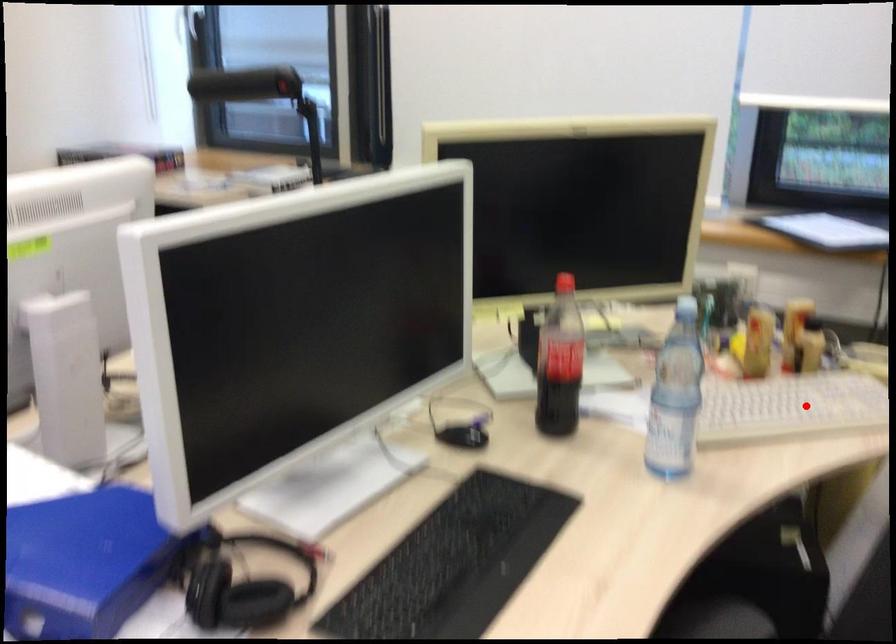
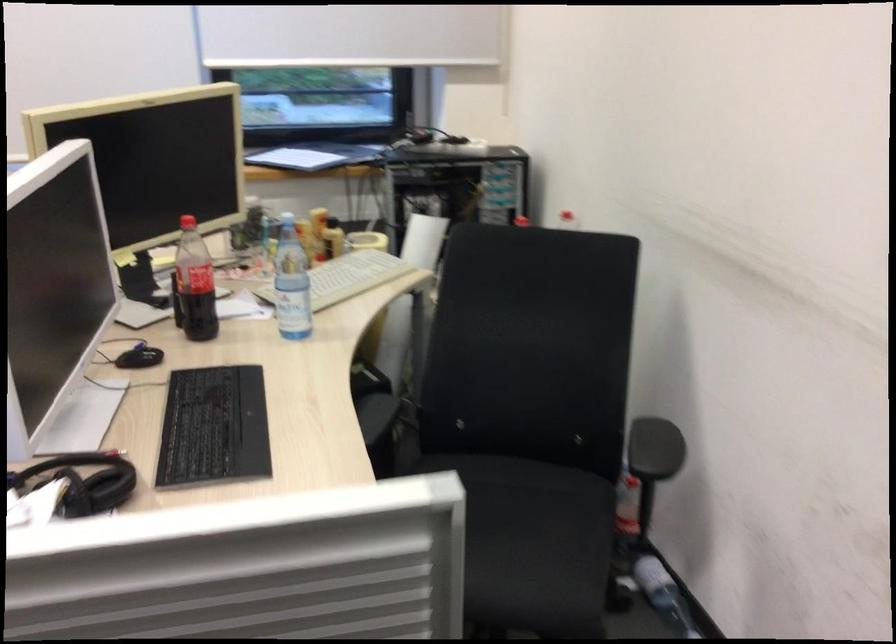
The point at the highlighted location is marked in the first image. Where is the corresponding point in the second image?

(347, 277)